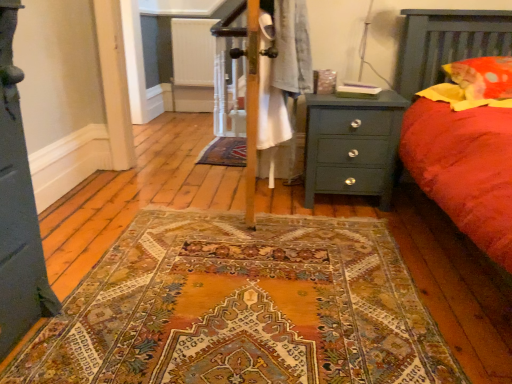
Question: Is red cotton pillow at upper right facing away from green matte nightstand at right?

Choices:
 (A) yes
 (B) no

Answer: (B)

Question: Is red cotton pillow at upper right positioned far away from green matte nightstand at right?

Choices:
 (A) no
 (B) yes

Answer: (A)

Question: Considering the relative sizes of red cotton pillow at upper right and green matte nightstand at right in the image provided, is red cotton pillow at upper right bigger than green matte nightstand at right?

Choices:
 (A) no
 (B) yes

Answer: (A)

Question: Can you confirm if red cotton pillow at upper right is wider than green matte nightstand at right?

Choices:
 (A) no
 (B) yes

Answer: (B)

Question: Does red cotton pillow at upper right lie behind green matte nightstand at right?

Choices:
 (A) no
 (B) yes

Answer: (A)

Question: From a real-world perspective, relative to green matte nightstand at right, is red cotton pillow at upper right vertically above or below?

Choices:
 (A) above
 (B) below

Answer: (A)

Question: Considering the positions of red cotton pillow at upper right and green matte nightstand at right in the image, is red cotton pillow at upper right bigger or smaller than green matte nightstand at right?

Choices:
 (A) small
 (B) big

Answer: (A)

Question: From the image's perspective, is red cotton pillow at upper right located above or below green matte nightstand at right?

Choices:
 (A) above
 (B) below

Answer: (A)

Question: Is red cotton pillow at upper right taller or shorter than green matte nightstand at right?

Choices:
 (A) tall
 (B) short

Answer: (B)

Question: From a real-world perspective, is white textured radiator at center above or below green matte nightstand at right?

Choices:
 (A) above
 (B) below

Answer: (A)

Question: Is point (199, 41) closer or farther from the camera than point (347, 127)?

Choices:
 (A) closer
 (B) farther

Answer: (B)

Question: Do you think white textured radiator at center is within green matte nightstand at right, or outside of it?

Choices:
 (A) inside
 (B) outside

Answer: (B)

Question: Is white textured radiator at center bigger or smaller than green matte nightstand at right?

Choices:
 (A) big
 (B) small

Answer: (B)

Question: From a real-world perspective, relative to white textured radiator at center, is green matte nightstand at right vertically above or below?

Choices:
 (A) below
 (B) above

Answer: (A)

Question: Looking at the image, does green matte nightstand at right seem bigger or smaller compared to white textured radiator at center?

Choices:
 (A) small
 (B) big

Answer: (B)